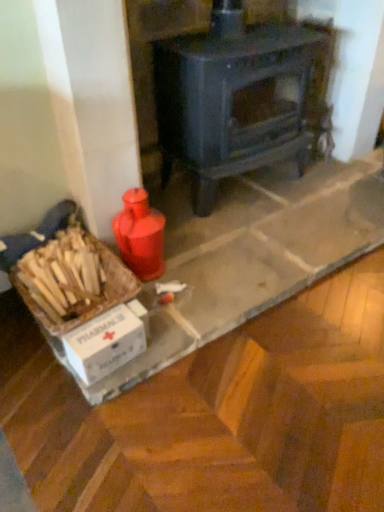
Question: Is white cardboard box at lower left smaller than matte black wood burning stove at center?

Choices:
 (A) no
 (B) yes

Answer: (B)

Question: Is the depth of white cardboard box at lower left greater than that of matte black wood burning stove at center?

Choices:
 (A) no
 (B) yes

Answer: (A)

Question: Does white cardboard box at lower left contain matte black wood burning stove at center?

Choices:
 (A) yes
 (B) no

Answer: (B)

Question: Considering the relative sizes of white cardboard box at lower left and matte black wood burning stove at center in the image provided, is white cardboard box at lower left shorter than matte black wood burning stove at center?

Choices:
 (A) no
 (B) yes

Answer: (B)

Question: Considering the relative sizes of white cardboard box at lower left and matte black wood burning stove at center in the image provided, is white cardboard box at lower left bigger than matte black wood burning stove at center?

Choices:
 (A) no
 (B) yes

Answer: (A)

Question: Is white cardboard box at lower left bigger or smaller than matte black wood burning stove at center?

Choices:
 (A) big
 (B) small

Answer: (B)

Question: Considering the positions of point (92, 245) and point (314, 33), is point (92, 245) closer or farther from the camera than point (314, 33)?

Choices:
 (A) closer
 (B) farther

Answer: (A)

Question: Do you think white cardboard box at lower left is within matte black wood burning stove at center, or outside of it?

Choices:
 (A) outside
 (B) inside

Answer: (A)

Question: Relative to matte black wood burning stove at center, is white cardboard box at lower left in front or behind?

Choices:
 (A) behind
 (B) front

Answer: (B)

Question: From a real-world perspective, relative to white cardboard box at lower left, is white cardboard box at lower left vertically above or below?

Choices:
 (A) above
 (B) below

Answer: (A)

Question: Choose the correct answer: Is white cardboard box at lower left inside white cardboard box at lower left or outside it?

Choices:
 (A) outside
 (B) inside

Answer: (A)

Question: Relative to white cardboard box at lower left, is white cardboard box at lower left in front or behind?

Choices:
 (A) behind
 (B) front

Answer: (A)

Question: Is white cardboard box at lower left taller or shorter than white cardboard box at lower left?

Choices:
 (A) tall
 (B) short

Answer: (A)

Question: From a real-world perspective, relative to white cardboard box at lower left, is matte black wood burning stove at center vertically above or below?

Choices:
 (A) below
 (B) above

Answer: (B)

Question: Would you say matte black wood burning stove at center is to the left or to the right of white cardboard box at lower left in the picture?

Choices:
 (A) left
 (B) right

Answer: (B)